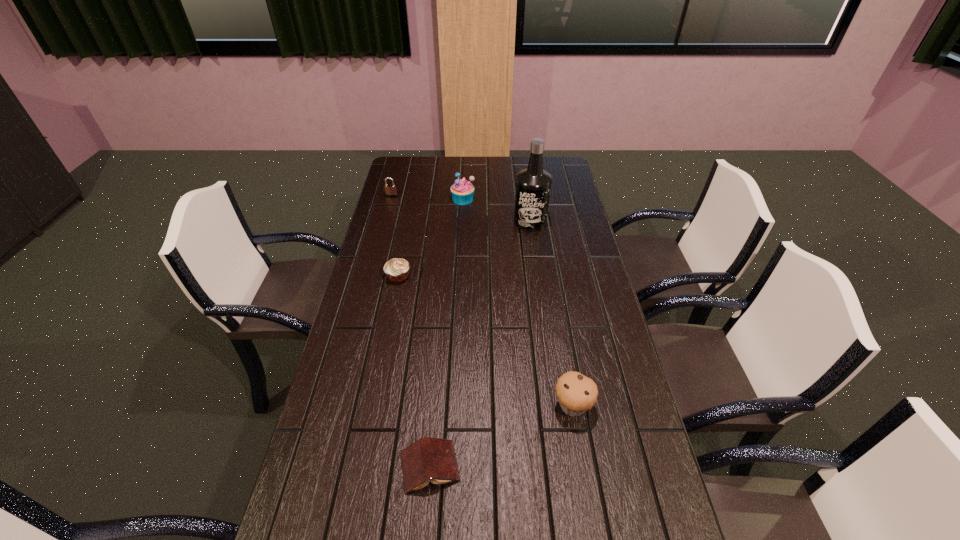
At what (x,y) coordinates should I click in order to perform the action: click on muffin located at the right edge. Please return your answer as a coordinate pair (x, y). The image size is (960, 540). Looking at the image, I should click on (576, 393).

The height and width of the screenshot is (540, 960). I want to click on vacant region at the far edge of the desktop, so click(x=498, y=157).

In the image, there is a desktop. Where is `vacant space at the left edge`? This screenshot has height=540, width=960. vacant space at the left edge is located at coordinates (351, 327).

Find the location of a particular element. The width and height of the screenshot is (960, 540). vacant area at the right edge of the desktop is located at coordinates (572, 227).

Image resolution: width=960 pixels, height=540 pixels. Identify the location of free region at the far left corner of the desktop. (x=403, y=167).

At what (x,y) coordinates should I click in order to perform the action: click on vacant space at the far right corner of the desktop. Please return your answer as a coordinate pair (x, y). Looking at the image, I should click on (564, 170).

You are a GUI agent. You are given a task and a screenshot of the screen. Output one action in this format:
    pyautogui.click(x=<x>, y=<y>)
    Task: Click on the blank region between the farthest muffin and the leftmost object
    This screenshot has width=960, height=540.
    Given the screenshot: What is the action you would take?
    pyautogui.click(x=427, y=198)

Locate an element on the screen. The width and height of the screenshot is (960, 540). free space between the farthest muffin and the book is located at coordinates [446, 333].

This screenshot has height=540, width=960. What are the coordinates of `blank region between the rightmost muffin and the leftmost muffin` in the screenshot? It's located at (486, 341).

You are a GUI agent. You are given a task and a screenshot of the screen. Output one action in this format:
    pyautogui.click(x=<x>, y=<y>)
    Task: Click on the unoccupied position between the nearest object and the second object from left to right
    
    Given the screenshot: What is the action you would take?
    pyautogui.click(x=414, y=371)